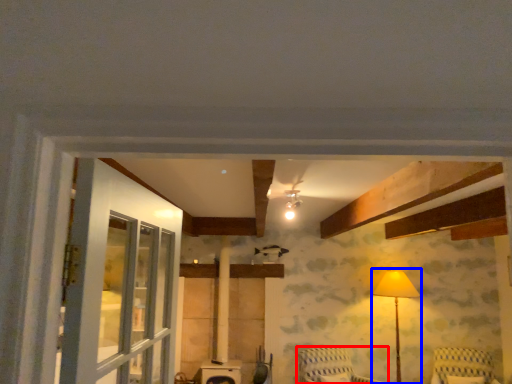
Question: Which object appears closest to the camera in this image, furniture (highlighted by a red box) or table lamp (highlighted by a blue box)?

Choices:
 (A) furniture
 (B) table lamp

Answer: (A)